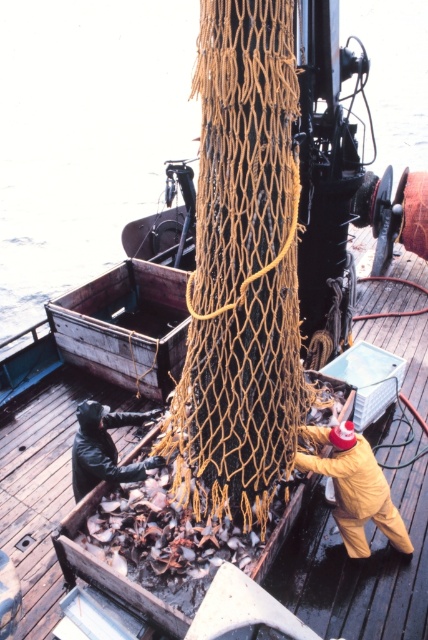
Question: Can you confirm if yellow matte overall at lower right is smaller than black rubber gloves at lower left?

Choices:
 (A) no
 (B) yes

Answer: (A)

Question: Can you confirm if yellow matte overall at lower right is positioned to the left of black rubber gloves at lower left?

Choices:
 (A) no
 (B) yes

Answer: (A)

Question: In this image, where is yellow matte overall at lower right located relative to black rubber gloves at lower left?

Choices:
 (A) below
 (B) above

Answer: (A)

Question: Which of the following is the farthest from the observer?

Choices:
 (A) black rubber gloves at lower left
 (B) yellow matte overall at lower right

Answer: (A)

Question: Which point is closer to the camera?

Choices:
 (A) (101, 468)
 (B) (332, 515)

Answer: (A)